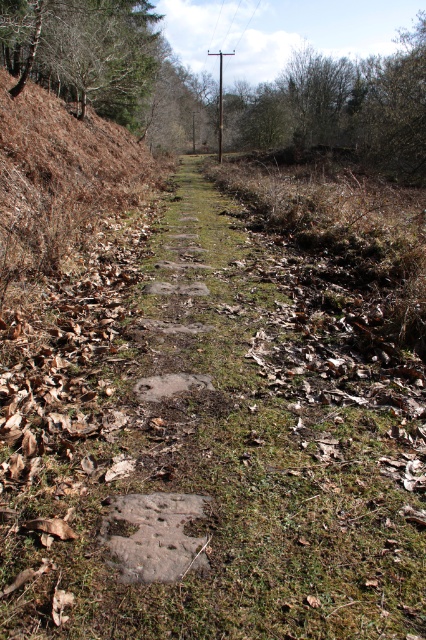
You are standing at the start of the path and want to walk towards the tree with leaves. Which tree should you head towards, the brown leafy tree at upper center or the brown bark tree at upper left?

The brown leafy tree at upper center is to the right of the brown bark tree at upper left, so you should head towards the brown leafy tree at upper center.

You are standing at the center of the narrow grassy path in the image. Looking towards the upper left corner, you see a point marked at coordinates (83, 51). What object is located at that point?

The point at (83, 51) marks the location of the brown bark tree at upper left.